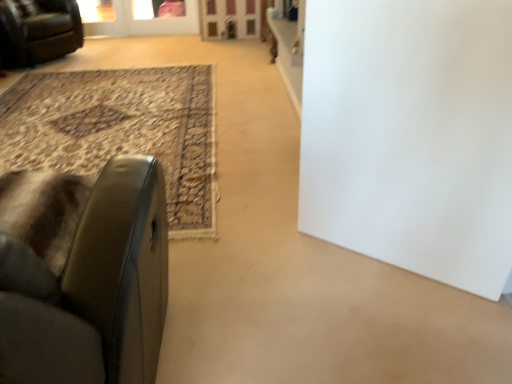
What do you see at coordinates (92, 288) in the screenshot?
I see `leather at left, the first chair viewed from the right` at bounding box center [92, 288].

Identify the location of white matte door at center. The image size is (512, 384). (411, 135).

Where is `wooden screen door at upper center, the 1th screen door when ordered from right to left`? Image resolution: width=512 pixels, height=384 pixels. wooden screen door at upper center, the 1th screen door when ordered from right to left is located at coordinates (229, 19).

Identify the location of leather at left, the first chair viewed from the right. This screenshot has width=512, height=384. [92, 288].

From the picture: Can you confirm if transparent glass screen door at upper center, positioned as the 2th screen door in right-to-left order, is positioned to the right of leather couch at upper left, which is counted as the first chair, starting from the left?

Yes, transparent glass screen door at upper center, positioned as the 2th screen door in right-to-left order, is to the right of leather couch at upper left, which is counted as the first chair, starting from the left.

Between transparent glass screen door at upper center, positioned as the 2th screen door in right-to-left order, and leather couch at upper left, which is counted as the first chair, starting from the left, which one has larger width?

Wider between the two is leather couch at upper left, which is counted as the first chair, starting from the left.

Are transparent glass screen door at upper center, positioned as the 2th screen door in right-to-left order, and leather couch at upper left, the 2th chair in the bottom-to-top sequence, located far from each other?

That's right, there is a large distance between transparent glass screen door at upper center, positioned as the 2th screen door in right-to-left order, and leather couch at upper left, the 2th chair in the bottom-to-top sequence.

Is leather couch at upper left, which ranks as the first chair in back-to-front order, a part of transparent glass screen door at upper center, positioned as the 2th screen door in right-to-left order?

Actually, leather couch at upper left, which ranks as the first chair in back-to-front order, is outside transparent glass screen door at upper center, positioned as the 2th screen door in right-to-left order.

From the image's perspective, is transparent glass screen door at upper center, marked as the 1th screen door in a left-to-right arrangement, above or below wooden screen door at upper center, arranged as the 2th screen door when viewed from the left?

Based on their image positions, transparent glass screen door at upper center, marked as the 1th screen door in a left-to-right arrangement, is located above wooden screen door at upper center, arranged as the 2th screen door when viewed from the left.

From the picture: Can you confirm if transparent glass screen door at upper center, positioned as the 2th screen door in right-to-left order, is bigger than wooden screen door at upper center, the 1th screen door when ordered from right to left?

No.

Visually, is wooden screen door at upper center, arranged as the 2th screen door when viewed from the left, positioned to the left or to the right of leather at left, the 2th chair in the top-to-bottom sequence?

wooden screen door at upper center, arranged as the 2th screen door when viewed from the left, is positioned on leather at left, the 2th chair in the top-to-bottom sequence,'s right side.

From the image's perspective, is wooden screen door at upper center, arranged as the 2th screen door when viewed from the left, beneath leather at left, which appears as the first chair when viewed from the front?

Incorrect, from the image's perspective, wooden screen door at upper center, arranged as the 2th screen door when viewed from the left, is higher than leather at left, which appears as the first chair when viewed from the front.

Consider the image. From a real-world perspective, relative to leather at left, which appears as the second chair when viewed from the left, is wooden screen door at upper center, the 1th screen door when ordered from right to left, vertically above or below?

In terms of real-world spatial position, wooden screen door at upper center, the 1th screen door when ordered from right to left, is below leather at left, which appears as the second chair when viewed from the left.

Can you tell me how much wooden screen door at upper center, arranged as the 2th screen door when viewed from the left, and leather at left, the first chair viewed from the right, differ in facing direction?

179 degrees separate the facing orientations of wooden screen door at upper center, arranged as the 2th screen door when viewed from the left, and leather at left, the first chair viewed from the right.

Which is correct: transparent glass screen door at upper center, positioned as the 2th screen door in right-to-left order, is inside leather at left, the 1th chair from the bottom, or outside of it?

transparent glass screen door at upper center, positioned as the 2th screen door in right-to-left order, lies outside leather at left, the 1th chair from the bottom.

How far apart are transparent glass screen door at upper center, positioned as the 2th screen door in right-to-left order, and leather at left, the 2th chair in the back-to-front sequence?

They are 15.74 feet apart.

Is transparent glass screen door at upper center, positioned as the 2th screen door in right-to-left order, in front of leather at left, the 2th chair in the back-to-front sequence?

No, transparent glass screen door at upper center, positioned as the 2th screen door in right-to-left order, is further to the viewer.

Is transparent glass screen door at upper center, positioned as the 2th screen door in right-to-left order, not close to leather at left, which appears as the second chair when viewed from the left?

Yes, transparent glass screen door at upper center, positioned as the 2th screen door in right-to-left order, and leather at left, which appears as the second chair when viewed from the left, are quite far apart.

You are a GUI agent. You are given a task and a screenshot of the screen. Output one action in this format:
    pyautogui.click(x=<x>, y=<y>)
    Task: Click on the chair on the right of leather couch at upper left, acting as the second chair starting from the right
    This screenshot has width=512, height=384.
    Given the screenshot: What is the action you would take?
    pyautogui.click(x=92, y=288)

Between leather at left, which appears as the first chair when viewed from the front, and leather couch at upper left, which ranks as the first chair in back-to-front order, which one has smaller width?

leather couch at upper left, which ranks as the first chair in back-to-front order.

Looking at this image, is leather at left, which appears as the second chair when viewed from the left, taller or shorter than leather couch at upper left, the 2th chair in the bottom-to-top sequence?

Considering their sizes, leather at left, which appears as the second chair when viewed from the left, has more height than leather couch at upper left, the 2th chair in the bottom-to-top sequence.

Which object is positioned more to the left, leather at left, which appears as the first chair when viewed from the front, or leather couch at upper left, placed as the 1th chair when sorted from top to bottom?

leather couch at upper left, placed as the 1th chair when sorted from top to bottom, is more to the left.

Is point (382, 102) positioned in front of point (48, 9)?

Yes, point (382, 102) is closer to viewer.

From the image's perspective, does white matte door at center appear lower than leather couch at upper left, the 2th chair in the bottom-to-top sequence?

Yes, from the image's perspective, white matte door at center is below leather couch at upper left, the 2th chair in the bottom-to-top sequence.

In terms of size, does white matte door at center appear bigger or smaller than leather couch at upper left, which ranks as the first chair in back-to-front order?

Clearly, white matte door at center is smaller in size than leather couch at upper left, which ranks as the first chair in back-to-front order.

Between white matte door at center and leather couch at upper left, which ranks as the first chair in back-to-front order, which one has larger width?

leather couch at upper left, which ranks as the first chair in back-to-front order.

Is point (466, 25) positioned before point (204, 6)?

Yes, point (466, 25) is closer to viewer.

Considering the sizes of objects white matte door at center and wooden screen door at upper center, the 1th screen door when ordered from right to left, in the image provided, who is bigger, white matte door at center or wooden screen door at upper center, the 1th screen door when ordered from right to left,?

With larger size is white matte door at center.

Can you confirm if white matte door at center is thinner than wooden screen door at upper center, the 1th screen door when ordered from right to left?

Indeed, white matte door at center has a lesser width compared to wooden screen door at upper center, the 1th screen door when ordered from right to left.

In order to click on chair that is the 1st one above the transparent glass screen door at upper center, positioned as the 2th screen door in right-to-left order (from a real-world perspective) in this screenshot , I will do `click(40, 33)`.

Locate an element on the screen. screen door on the left of the wooden screen door at upper center, arranged as the 2th screen door when viewed from the left is located at coordinates (144, 23).

Estimate the real-world distances between objects in this image. Which object is closer to leather couch at upper left, placed as the 1th chair when sorted from top to bottom, leather at left, the 1th chair from the bottom, or white matte door at center?

leather at left, the 1th chair from the bottom, lies closer to leather couch at upper left, placed as the 1th chair when sorted from top to bottom, than the other object.

Looking at the image, which one is located further to wooden screen door at upper center, the 1th screen door when ordered from right to left, transparent glass screen door at upper center, marked as the 1th screen door in a left-to-right arrangement, or leather couch at upper left, placed as the 1th chair when sorted from top to bottom?

leather couch at upper left, placed as the 1th chair when sorted from top to bottom, is positioned further to the anchor wooden screen door at upper center, the 1th screen door when ordered from right to left.

Which object lies further to the anchor point transparent glass screen door at upper center, positioned as the 2th screen door in right-to-left order, leather couch at upper left, which ranks as the first chair in back-to-front order, or wooden screen door at upper center, arranged as the 2th screen door when viewed from the left?

leather couch at upper left, which ranks as the first chair in back-to-front order, lies further to transparent glass screen door at upper center, positioned as the 2th screen door in right-to-left order, than the other object.

Estimate the real-world distances between objects in this image. Which object is further from transparent glass screen door at upper center, positioned as the 2th screen door in right-to-left order, wooden screen door at upper center, arranged as the 2th screen door when viewed from the left, or white matte door at center?

Based on the image, white matte door at center appears to be further to transparent glass screen door at upper center, positioned as the 2th screen door in right-to-left order.

Which object lies nearer to the anchor point transparent glass screen door at upper center, marked as the 1th screen door in a left-to-right arrangement, wooden screen door at upper center, the 1th screen door when ordered from right to left, or leather couch at upper left, which ranks as the first chair in back-to-front order?

The object closer to transparent glass screen door at upper center, marked as the 1th screen door in a left-to-right arrangement, is wooden screen door at upper center, the 1th screen door when ordered from right to left.

Looking at this image, which object lies nearer to the anchor point white matte door at center, leather couch at upper left, the 2th chair in the bottom-to-top sequence, or transparent glass screen door at upper center, marked as the 1th screen door in a left-to-right arrangement?

leather couch at upper left, the 2th chair in the bottom-to-top sequence, is closer to white matte door at center.

When comparing their distances from transparent glass screen door at upper center, positioned as the 2th screen door in right-to-left order, does leather at left, which appears as the second chair when viewed from the left, or leather couch at upper left, acting as the second chair starting from the right, seem further?

leather at left, which appears as the second chair when viewed from the left.

Estimate the real-world distances between objects in this image. Which object is closer to leather couch at upper left, which is counted as the first chair, starting from the left, white matte door at center or transparent glass screen door at upper center, marked as the 1th screen door in a left-to-right arrangement?

Among the two, transparent glass screen door at upper center, marked as the 1th screen door in a left-to-right arrangement, is located nearer to leather couch at upper left, which is counted as the first chair, starting from the left.

Where is `chair between white matte door at center and wooden screen door at upper center, the 1th screen door when ordered from right to left, from front to back`? The width and height of the screenshot is (512, 384). chair between white matte door at center and wooden screen door at upper center, the 1th screen door when ordered from right to left, from front to back is located at coordinates (40, 33).

Identify the location of screen door between white matte door at center and transparent glass screen door at upper center, marked as the 1th screen door in a left-to-right arrangement, from front to back. (229, 19).

Identify the location of chair located between leather at left, the 2th chair in the top-to-bottom sequence, and wooden screen door at upper center, arranged as the 2th screen door when viewed from the left, in the depth direction. (40, 33).

The image size is (512, 384). Find the location of `screen door between leather at left, the 2th chair in the top-to-bottom sequence, and transparent glass screen door at upper center, positioned as the 2th screen door in right-to-left order, in the front-back direction`. screen door between leather at left, the 2th chair in the top-to-bottom sequence, and transparent glass screen door at upper center, positioned as the 2th screen door in right-to-left order, in the front-back direction is located at coordinates (229, 19).